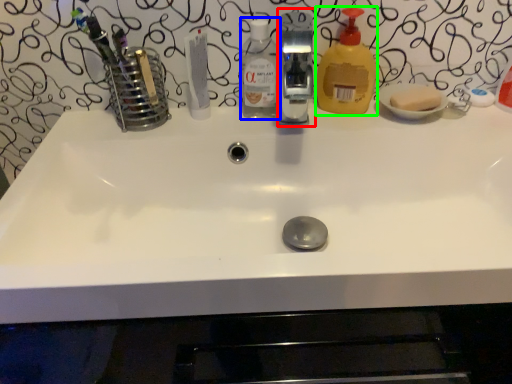
Question: Based on their relative distances, which object is nearer to fixture (highlighted by a red box)? Choose from bottle (highlighted by a blue box) and cleaning product (highlighted by a green box).

Choices:
 (A) bottle
 (B) cleaning product

Answer: (B)